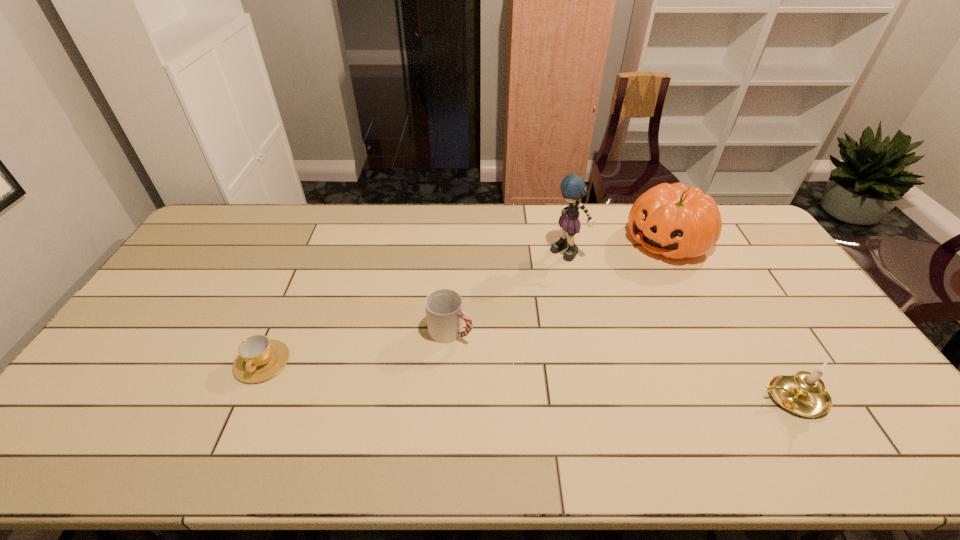
You are a GUI agent. You are given a task and a screenshot of the screen. Output one action in this format:
    pyautogui.click(x=<x>, y=<y>)
    Task: Click on the leftmost object
    The width and height of the screenshot is (960, 540).
    Given the screenshot: What is the action you would take?
    pyautogui.click(x=260, y=358)

The image size is (960, 540). What are the coordinates of `the left cup` in the screenshot? It's located at (260, 358).

The width and height of the screenshot is (960, 540). In order to click on candle holder in this screenshot , I will do `click(804, 393)`.

This screenshot has width=960, height=540. Find the location of `rag doll`. rag doll is located at coordinates (573, 188).

Find the location of `the tallest object`. the tallest object is located at coordinates (573, 188).

Find the location of `the fourth shortest object`. the fourth shortest object is located at coordinates (676, 221).

The width and height of the screenshot is (960, 540). Identify the location of the taller cup. (444, 314).

Identify the location of the right cup. (444, 314).

The height and width of the screenshot is (540, 960). I want to click on vacant space located with the handle on the side of the shortest object, so point(238,416).

At what (x,y) coordinates should I click in order to perform the action: click on vacant area situated 0.180m on the handle side of the third tallest object. Please return your answer as a coordinate pair (x, y). The image size is (960, 540). Looking at the image, I should click on (687, 397).